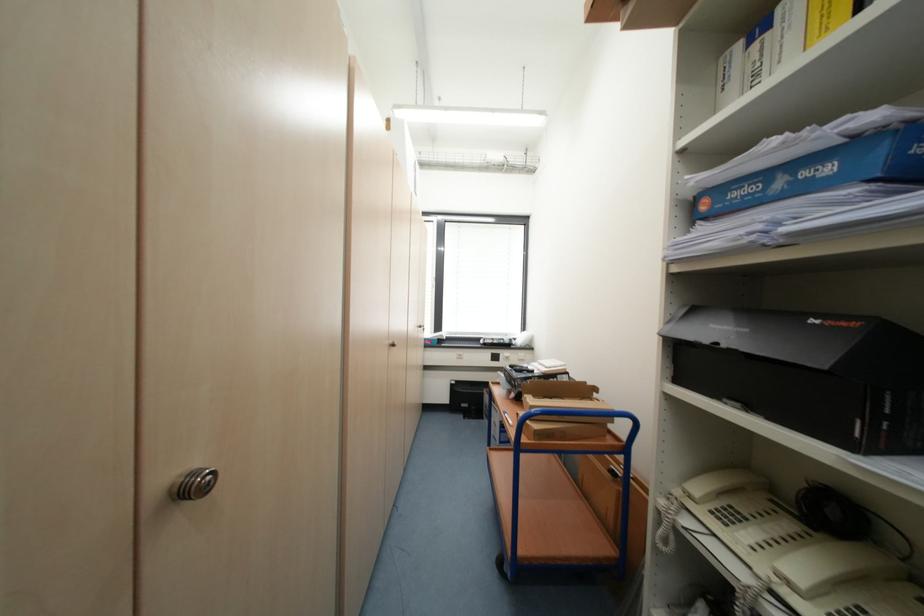
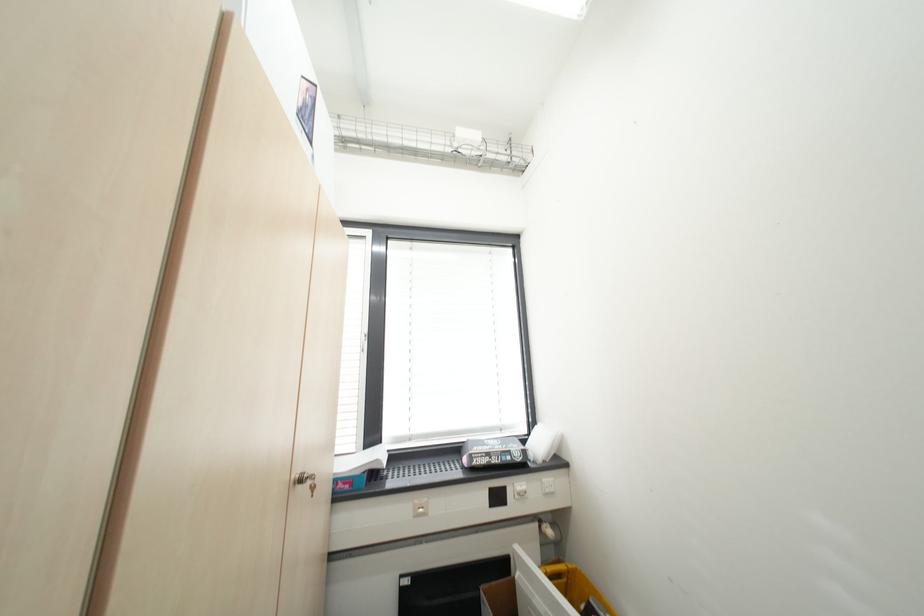
Question: The images are taken continuously from a first-person perspective. In which direction are you moving?

Choices:
 (A) Left
 (B) Right
 (C) Forward
 (D) Backward

Answer: (C)